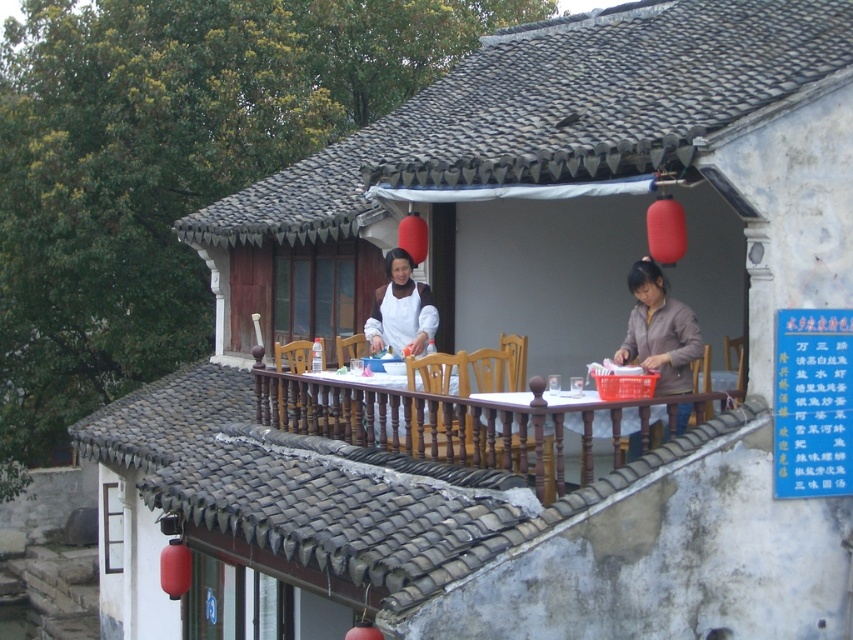
You are standing at point A and want to reach the wooden table at center. Which direction should you move? The coordinates of point A are given as point A is located at point (585, 420).

The wooden table at center is located at point (585, 420), so you are already at the wooden table at center.

You are standing at the entrance of the traditional building and want to walk towards the point labeled as point (374, 294). However, there is an obstacle at point (595, 429). Can you reach your destination without going around the obstacle?

Since point (595, 429) is in front of point (374, 294), you cannot reach point (374, 294) without going around the obstacle at point (595, 429).